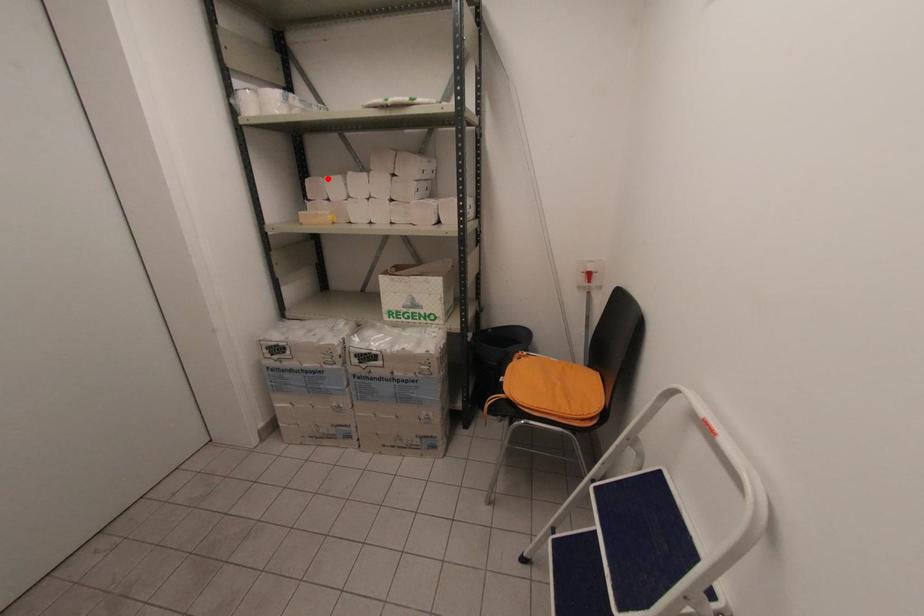
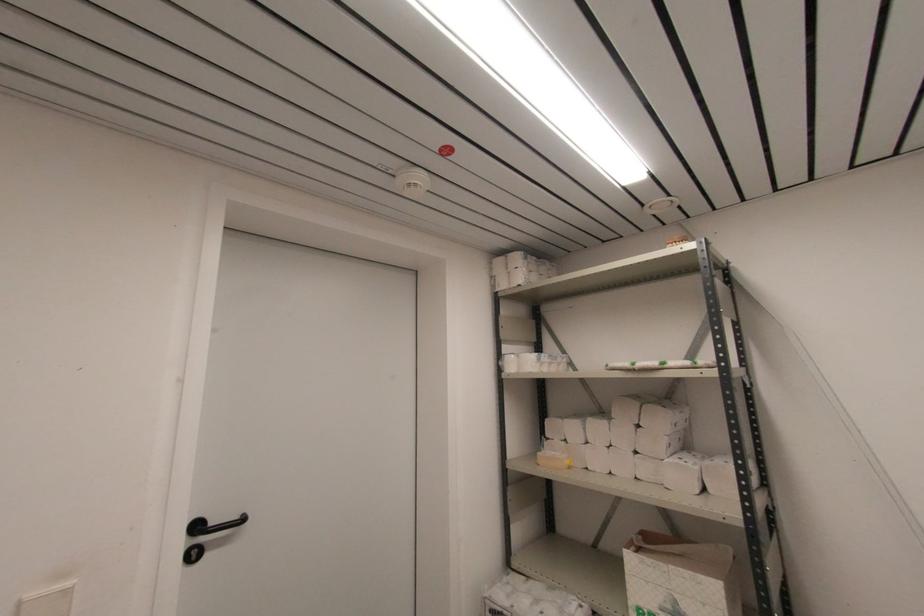
Where in the second image is the point corresponding to the highlighted location from the first image?

(566, 421)